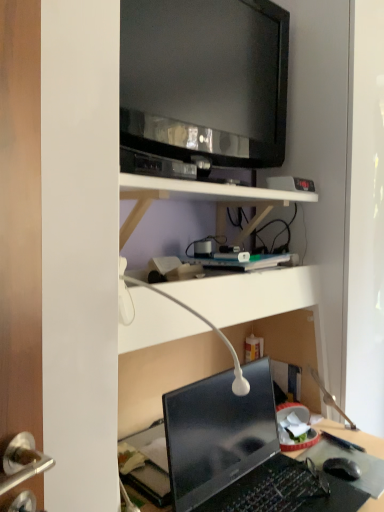
Locate an element on the screen. empty space that is to the right of black matte computer mouse at lower right is located at coordinates (370, 472).